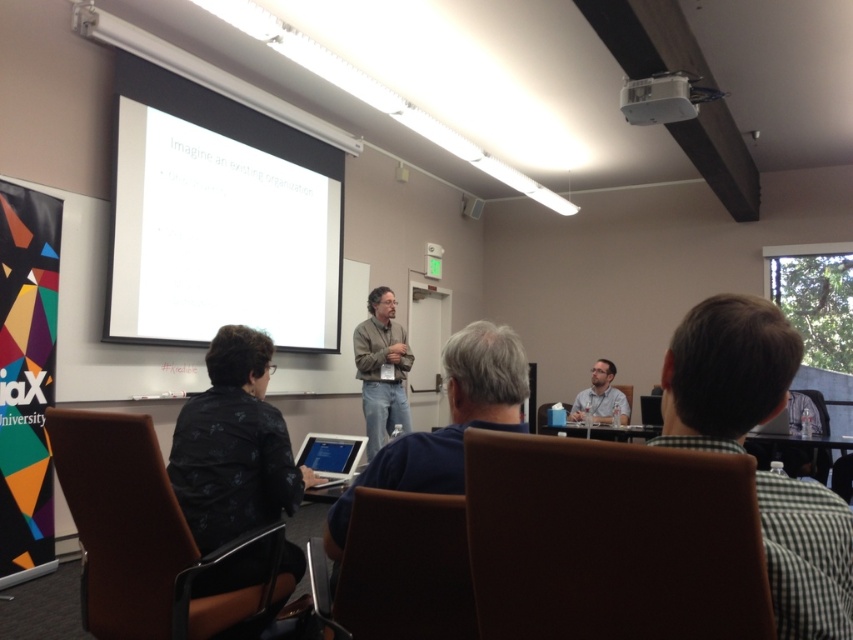
Consider the image. Is black textured jacket at lower left thinner than white plastic projector at upper center?

Correct, black textured jacket at lower left's width is less than white plastic projector at upper center's.

Describe the element at coordinates (233, 445) in the screenshot. I see `black textured jacket at lower left` at that location.

Describe the element at coordinates (233, 445) in the screenshot. The height and width of the screenshot is (640, 853). I see `black textured jacket at lower left` at that location.

Locate an element on the screen. This screenshot has width=853, height=640. black textured jacket at lower left is located at coordinates (233, 445).

Can you confirm if brown checkered shirt at lower right is bigger than matte black laptop at center?

Yes.

Is point (688, 444) positioned in front of point (462, 202)?

Yes, it is.

You are a GUI agent. You are given a task and a screenshot of the screen. Output one action in this format:
    pyautogui.click(x=<x>, y=<y>)
    Task: Click on the brown checkered shirt at lower right
    The image size is (853, 640).
    Given the screenshot: What is the action you would take?
    724,372

Does point (705, 410) lie in front of point (236, 584)?

Yes, point (705, 410) is closer to viewer.

In the scene shown: Does brown checkered shirt at lower right have a greater width compared to black textured jacket at lower left?

Incorrect, brown checkered shirt at lower right's width does not surpass black textured jacket at lower left's.

Locate an element on the screen. brown checkered shirt at lower right is located at coordinates (724, 372).

Locate an element on the screen. brown checkered shirt at lower right is located at coordinates (724, 372).